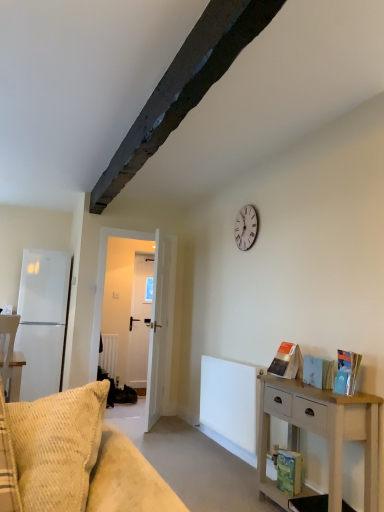
Question: Does white wooden door at center appear on the left side of white matte refrigerator at left?

Choices:
 (A) no
 (B) yes

Answer: (A)

Question: Is there a large distance between white wooden door at center and white matte refrigerator at left?

Choices:
 (A) yes
 (B) no

Answer: (B)

Question: Is white wooden door at center aimed at white matte refrigerator at left?

Choices:
 (A) no
 (B) yes

Answer: (A)

Question: Considering the relative positions of white wooden door at center and white matte refrigerator at left in the image provided, is white wooden door at center to the right of white matte refrigerator at left from the viewer's perspective?

Choices:
 (A) yes
 (B) no

Answer: (A)

Question: Is white wooden door at center positioned behind white matte refrigerator at left?

Choices:
 (A) yes
 (B) no

Answer: (B)

Question: Based on their positions, is white matte refrigerator at left located to the left or right of white wooden door at center?

Choices:
 (A) right
 (B) left

Answer: (B)

Question: From a real-world perspective, is white matte refrigerator at left above or below white wooden door at center?

Choices:
 (A) below
 (B) above

Answer: (A)

Question: Would you say white matte refrigerator at left is inside or outside white wooden door at center?

Choices:
 (A) outside
 (B) inside

Answer: (A)

Question: Looking at the image, does white matte refrigerator at left seem bigger or smaller compared to white wooden door at center?

Choices:
 (A) big
 (B) small

Answer: (A)

Question: From their relative heights in the image, would you say white wooden door at center is taller or shorter than white matte refrigerator at left?

Choices:
 (A) short
 (B) tall

Answer: (B)

Question: In the image, is white wooden door at center positioned in front of or behind white matte refrigerator at left?

Choices:
 (A) front
 (B) behind

Answer: (A)

Question: Is white wooden door at center to the left or to the right of white matte refrigerator at left in the image?

Choices:
 (A) left
 (B) right

Answer: (B)

Question: Does point (92, 351) appear closer or farther from the camera than point (59, 300)?

Choices:
 (A) closer
 (B) farther

Answer: (A)

Question: From a real-world perspective, is hardcover book at right, marked as the 4th book in a back-to-front arrangement, above or below white ribbed radiator at center?

Choices:
 (A) above
 (B) below

Answer: (A)

Question: From the image's perspective, is hardcover book at right, positioned as the 1th book in top-to-bottom order, located above or below white ribbed radiator at center?

Choices:
 (A) above
 (B) below

Answer: (A)